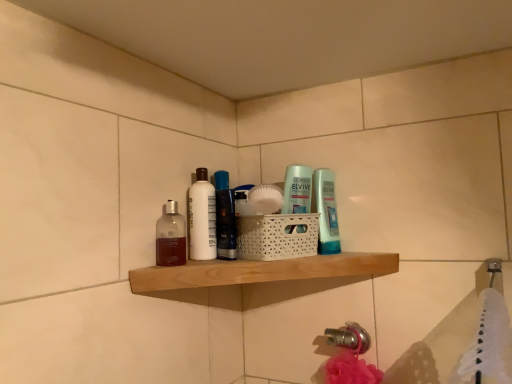
Question: Which is correct: translucent glass mouthwash at shelf center, placed as the 2th mouthwash when sorted from right to left, is inside translucent plastic bottle at center, marked as the 2th toiletry in a left-to-right arrangement, or outside of it?

Choices:
 (A) inside
 (B) outside

Answer: (B)

Question: In the image, is translucent glass mouthwash at shelf center, placed as the 2th mouthwash when sorted from right to left, positioned in front of or behind translucent plastic bottle at center, marked as the 2th toiletry in a left-to-right arrangement?

Choices:
 (A) front
 (B) behind

Answer: (A)

Question: Based on their relative distances, which object is farther from the translucent plastic mouthwash at center, the first mouthwash when ordered from back to front?

Choices:
 (A) translucent plastic bottle at center, marked as the 2th toiletry in a left-to-right arrangement
 (B) translucent glass mouthwash at shelf center, placed as the 2th mouthwash when sorted from right to left
 (C) natural wood shelf at center
 (D) white matte bottle at center, arranged as the first toiletry when viewed from the left

Answer: (A)

Question: Which object is positioned closest to the translucent plastic bottle at center, marked as the 2th toiletry in a left-to-right arrangement?

Choices:
 (A) white matte bottle at center, which is the second toiletry from right to left
 (B) translucent glass mouthwash at shelf center, acting as the 1th mouthwash starting from the left
 (C) translucent plastic mouthwash at center, which appears as the first mouthwash when viewed from the right
 (D) natural wood shelf at center

Answer: (D)